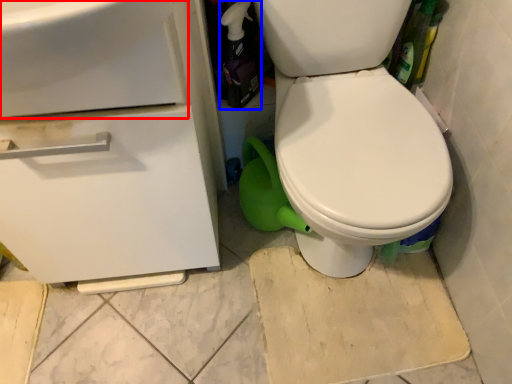
Question: Which point is further to the camera, sink (highlighted by a red box) or bottle (highlighted by a blue box)?

Choices:
 (A) sink
 (B) bottle

Answer: (B)